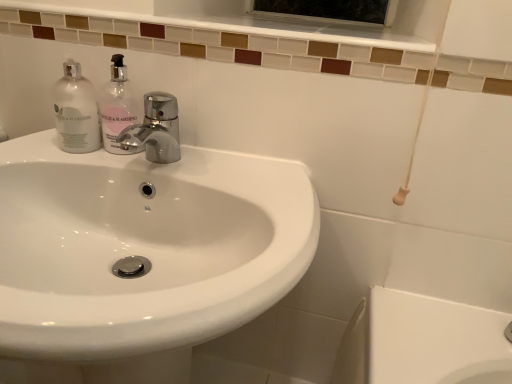
Question: From the image's perspective, is clear glass bottle at left located above or below white glossy sink at center?

Choices:
 (A) above
 (B) below

Answer: (A)

Question: Does point (72, 86) appear closer or farther from the camera than point (124, 367)?

Choices:
 (A) closer
 (B) farther

Answer: (B)

Question: Estimate the real-world distances between objects in this image. Which object is closer to the clear glass bottle at left?

Choices:
 (A) translucent glass soap dispenser at upper left
 (B) white glossy sink at center

Answer: (A)

Question: Estimate the real-world distances between objects in this image. Which object is closer to the clear glass bottle at left?

Choices:
 (A) white glossy sink at center
 (B) translucent glass soap dispenser at upper left

Answer: (B)